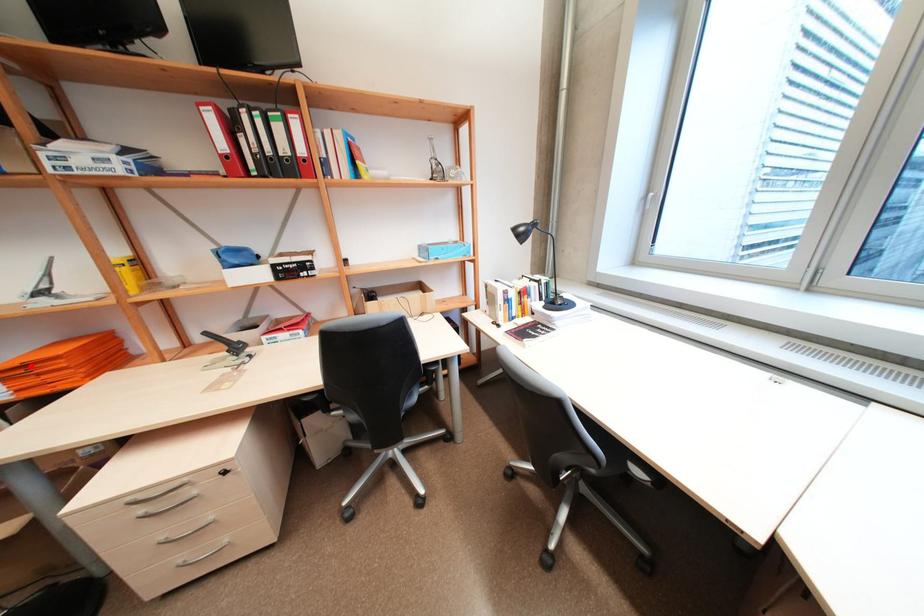
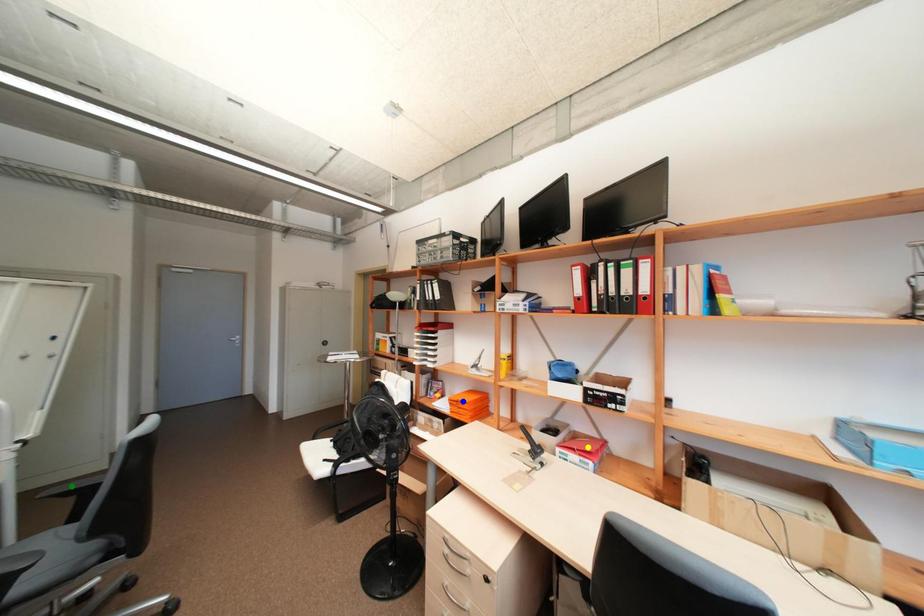
Question: I am providing you with two images of the same scene from different viewpoints. A red point is marked on the first image. You are given multiple points on the second image. Which mark in image 2 goes with the point in image 1?

Choices:
 (A) blue point
 (B) green point
 (C) yellow point

Answer: (A)